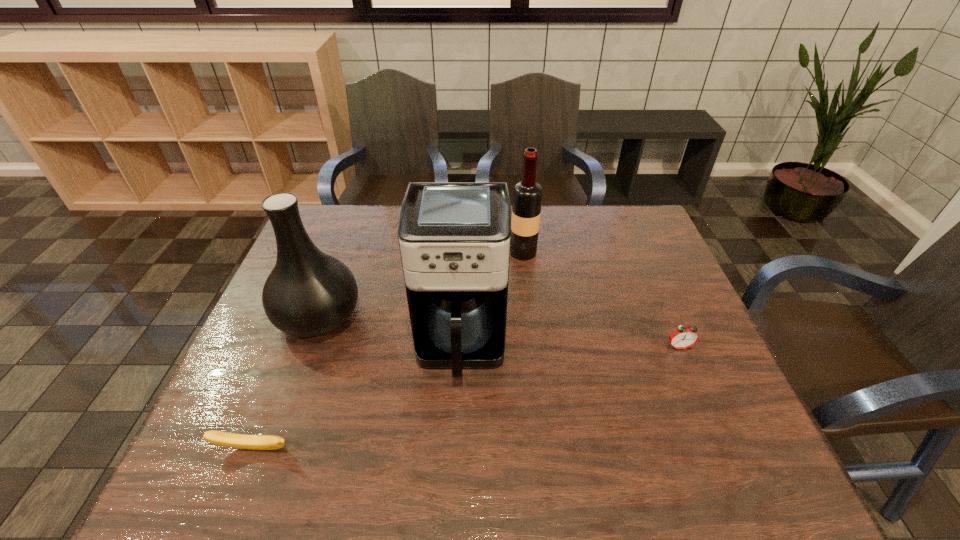
Find the location of `vacant area that lies between the banana and the coffee maker`. vacant area that lies between the banana and the coffee maker is located at coordinates (357, 396).

You are a GUI agent. You are given a task and a screenshot of the screen. Output one action in this format:
    pyautogui.click(x=<x>, y=<y>)
    Task: Click on the closest object to the third object from right to left
    
    Given the screenshot: What is the action you would take?
    pyautogui.click(x=309, y=293)

Image resolution: width=960 pixels, height=540 pixels. Identify the location of the fourth closest object to the coffee maker. (683, 337).

Find the location of a particular element. The width and height of the screenshot is (960, 540). vacant area in the image that satisfies the following two spatial constraints: 1. on the back side of the wine bottle; 2. on the right side of the vase is located at coordinates (343, 252).